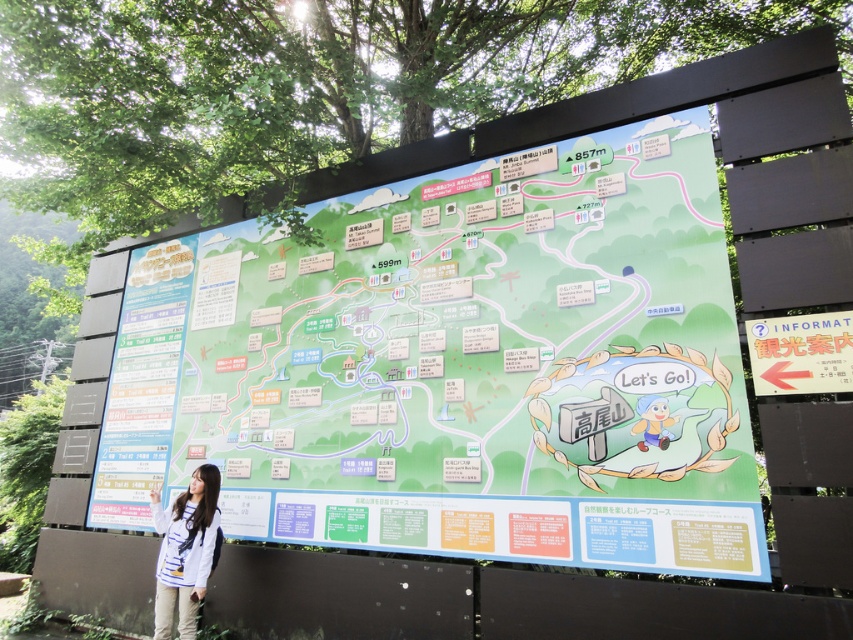
Which is in front, point (708, 337) or point (169, 554)?

Positioned in front is point (708, 337).

Between point (741, 561) and point (209, 483), which one is positioned behind?

Positioned behind is point (209, 483).

Which is behind, point (173, 308) or point (215, 564)?

Point (173, 308)

Where is `green paper map at center`? This screenshot has width=853, height=640. green paper map at center is located at coordinates (457, 365).

Is white striped shirt at lower left thinner than matte red sign at right?

Incorrect, white striped shirt at lower left's width is not less than matte red sign at right's.

Where is `white striped shirt at lower left`? The height and width of the screenshot is (640, 853). white striped shirt at lower left is located at coordinates (184, 550).

Can you confirm if green paper map at center is taller than matte red sign at right?

Correct, green paper map at center is much taller as matte red sign at right.

This screenshot has width=853, height=640. Describe the element at coordinates (457, 365) in the screenshot. I see `green paper map at center` at that location.

At what (x,y) coordinates should I click in order to perform the action: click on green paper map at center. Please return your answer as a coordinate pair (x, y). This screenshot has height=640, width=853. Looking at the image, I should click on (457, 365).